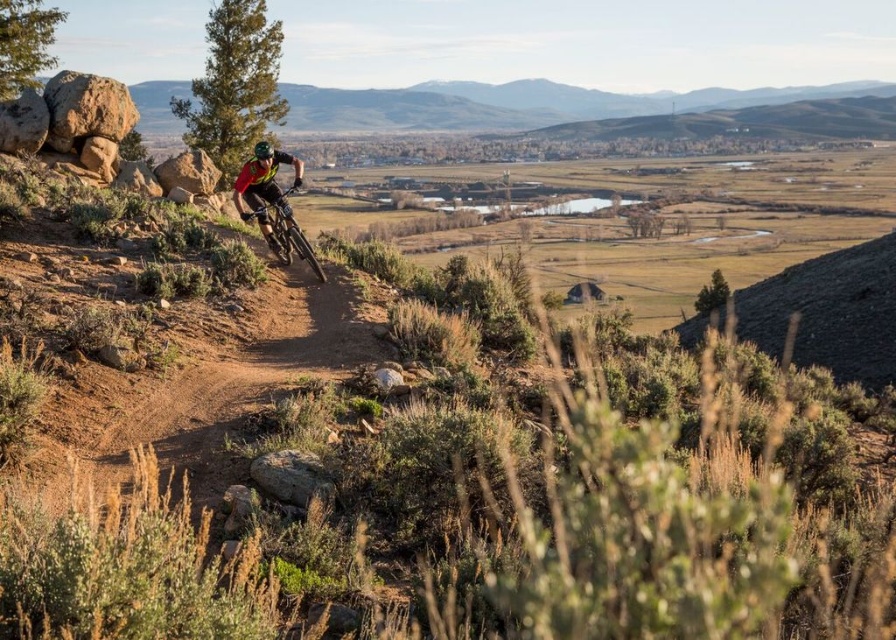
You are a photographer positioned to capture the mountain biker. You notice the red fabric helmet at center and the shiny metallic bicycle at center in your viewfinder. Which object appears wider in the frame?

The red fabric helmet at center appears wider than the shiny metallic bicycle at center because its width surpasses that of the bicycle.